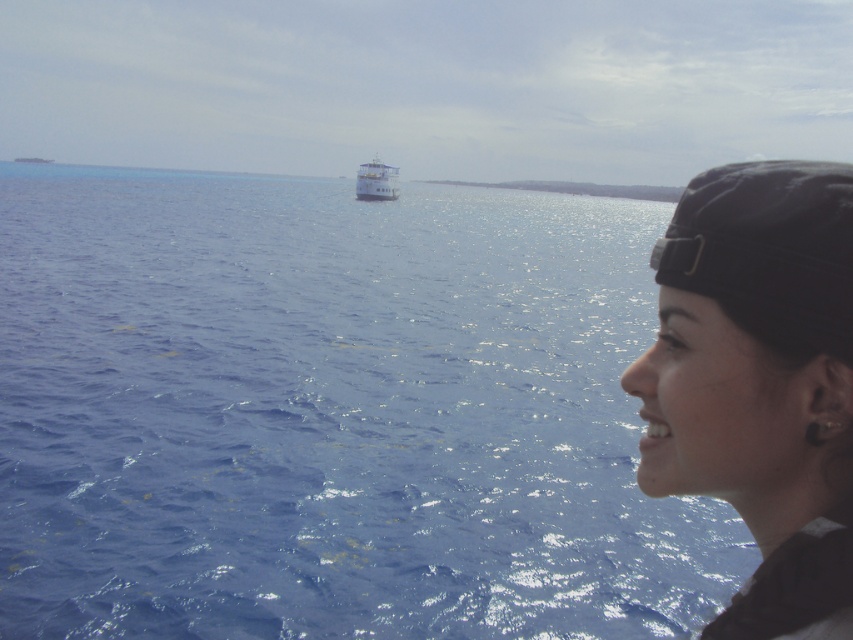
Who is positioned more to the right, black matte headband at right or white glossy boat at center?

Positioned to the right is black matte headband at right.

Can you confirm if black matte headband at right is positioned to the left of white glossy boat at center?

Incorrect, black matte headband at right is not on the left side of white glossy boat at center.

The image size is (853, 640). What do you see at coordinates (759, 380) in the screenshot?
I see `black matte headband at right` at bounding box center [759, 380].

Identify the location of black matte headband at right. The width and height of the screenshot is (853, 640). (759, 380).

Does blue glossy water at center appear under black matte headband at right?

No, blue glossy water at center is not below black matte headband at right.

Between blue glossy water at center and black matte headband at right, which one is positioned higher?

blue glossy water at center

Locate an element on the screen. Image resolution: width=853 pixels, height=640 pixels. blue glossy water at center is located at coordinates (332, 413).

Can you confirm if blue glossy water at center is shorter than white glossy boat at center?

No, blue glossy water at center is not shorter than white glossy boat at center.

Between blue glossy water at center and white glossy boat at center, which one is positioned lower?

Positioned lower is blue glossy water at center.

You are a GUI agent. You are given a task and a screenshot of the screen. Output one action in this format:
    pyautogui.click(x=<x>, y=<y>)
    Task: Click on the blue glossy water at center
    The image size is (853, 640).
    Given the screenshot: What is the action you would take?
    pyautogui.click(x=332, y=413)

I want to click on blue glossy water at center, so click(x=332, y=413).